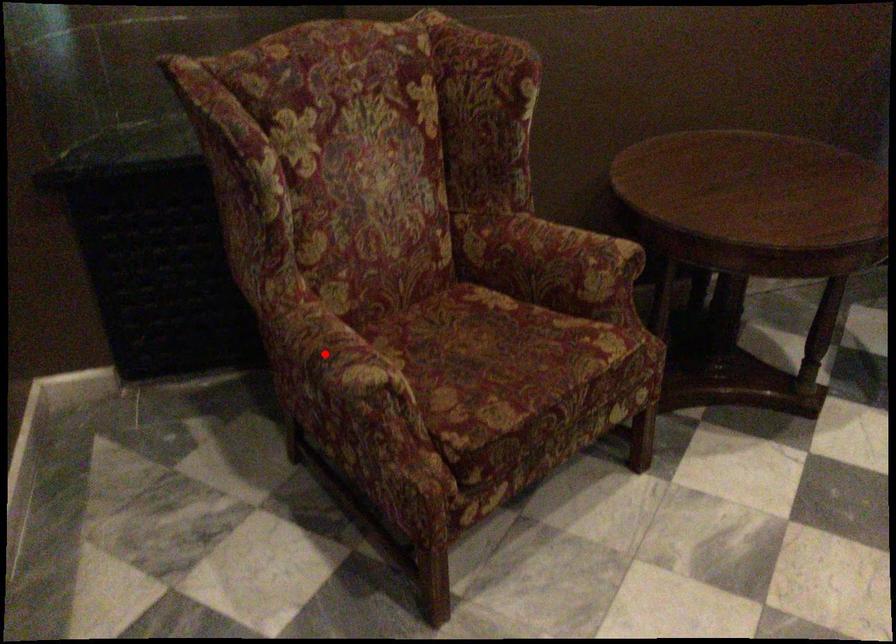
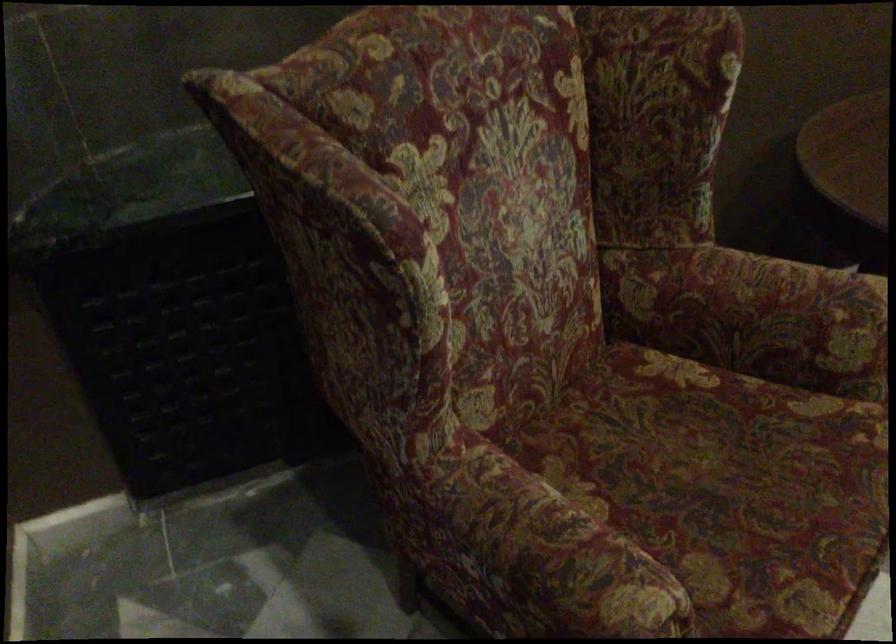
Question: I am providing you with two images of the same scene from different viewpoints. In image1, a red point is highlighted. Considering the same 3D point in image2, which of the following is correct?

Choices:
 (A) It is closer
 (B) It is farther

Answer: (A)